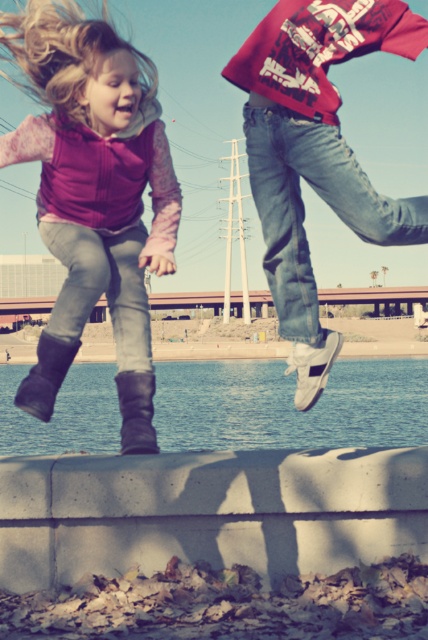
Between point (86, 122) and point (380, 365), which one is positioned in front?

Point (86, 122) is in front.

Can you confirm if matte pink vest at upper left is positioned above blue water at lower center?

Correct, matte pink vest at upper left is located above blue water at lower center.

Locate an element on the screen. The height and width of the screenshot is (640, 428). matte pink vest at upper left is located at coordinates (94, 195).